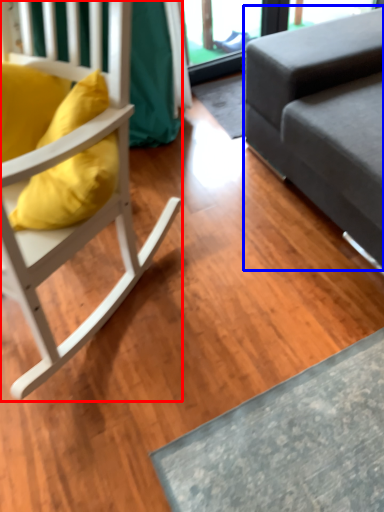
Question: Which object is further to the camera taking this photo, chair (highlighted by a red box) or studio couch (highlighted by a blue box)?

Choices:
 (A) chair
 (B) studio couch

Answer: (B)